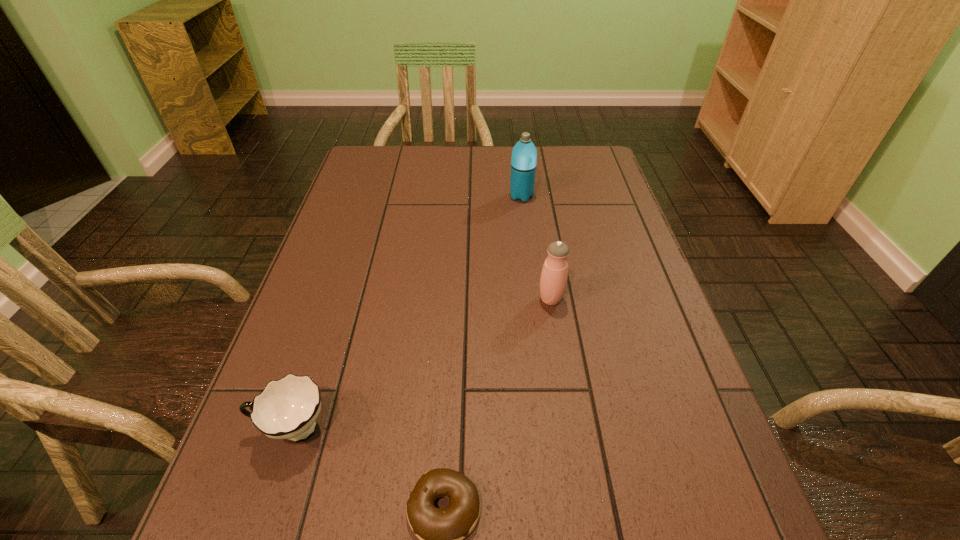
Find the location of a particular element. Image resolution: width=960 pixels, height=540 pixels. blank region between the farther thermos bottle and the leftmost object is located at coordinates (407, 313).

The width and height of the screenshot is (960, 540). In order to click on object that can be found as the third closest to the third tallest object in this screenshot , I will do `click(524, 154)`.

Select which object appears as the third closest to the taller thermos bottle. Please provide its 2D coordinates. Your answer should be formatted as a tuple, i.e. [(x, y)], where the tuple contains the x and y coordinates of a point satisfying the conditions above.

[(441, 532)]

Locate an element on the screen. Image resolution: width=960 pixels, height=540 pixels. free region that satisfies the following two spatial constraints: 1. on the side of the nearer thermos bottle with the handle; 2. on the left side of the second nearest object is located at coordinates (334, 299).

The image size is (960, 540). In order to click on vacant space that satisfies the following two spatial constraints: 1. on the side of the leftmost object with the handle; 2. on the right side of the third nearest object in this screenshot , I will do `click(334, 299)`.

The image size is (960, 540). I want to click on free region that satisfies the following two spatial constraints: 1. on the side of the farthest object with the handle; 2. on the left side of the leftmost object, so [x=368, y=196].

Locate an element on the screen. The width and height of the screenshot is (960, 540). blank area in the image that satisfies the following two spatial constraints: 1. on the side of the second shortest object with the handle; 2. on the back side of the farther thermos bottle is located at coordinates (368, 196).